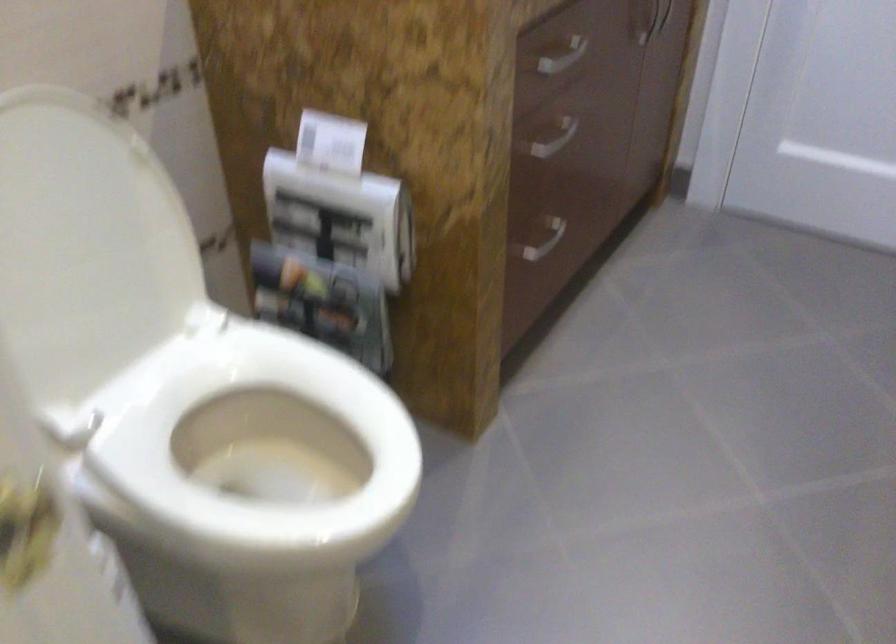
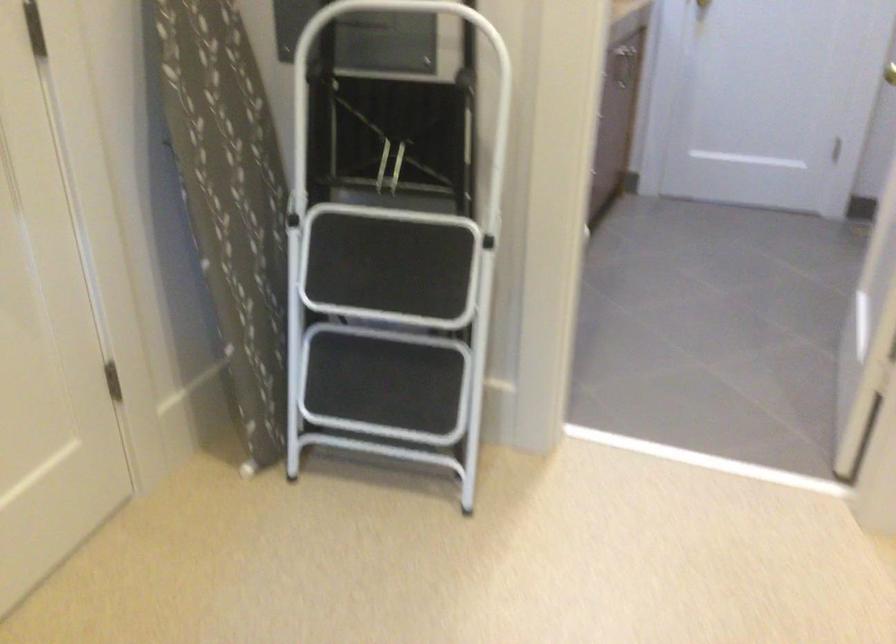
Question: I am providing you with two images of the same scene from different viewpoints. Which of the following objects are not visible in image2?

Choices:
 (A) white hood drawstring
 (B) patterned ironing board
 (C) gold door handle
 (D) white toilet seat

Answer: (D)